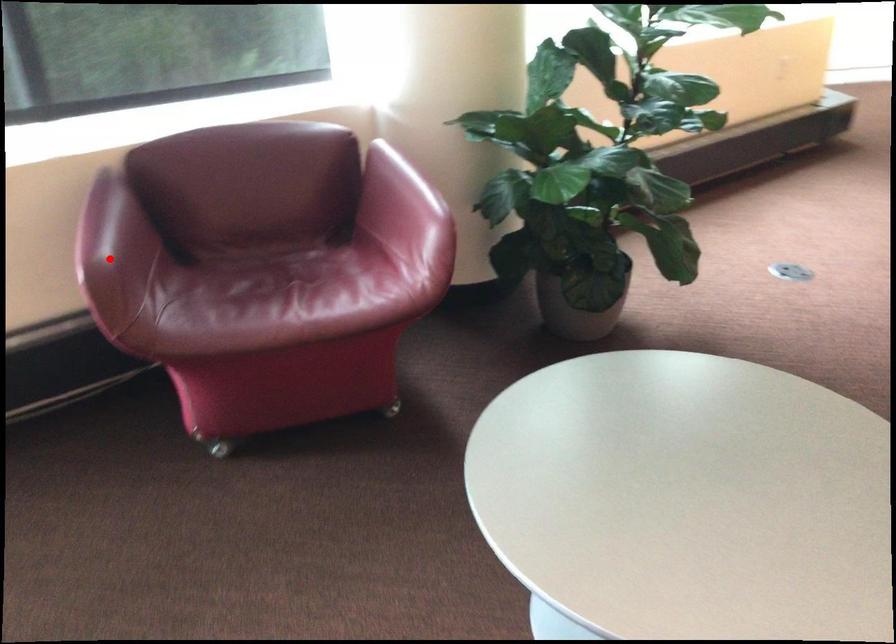
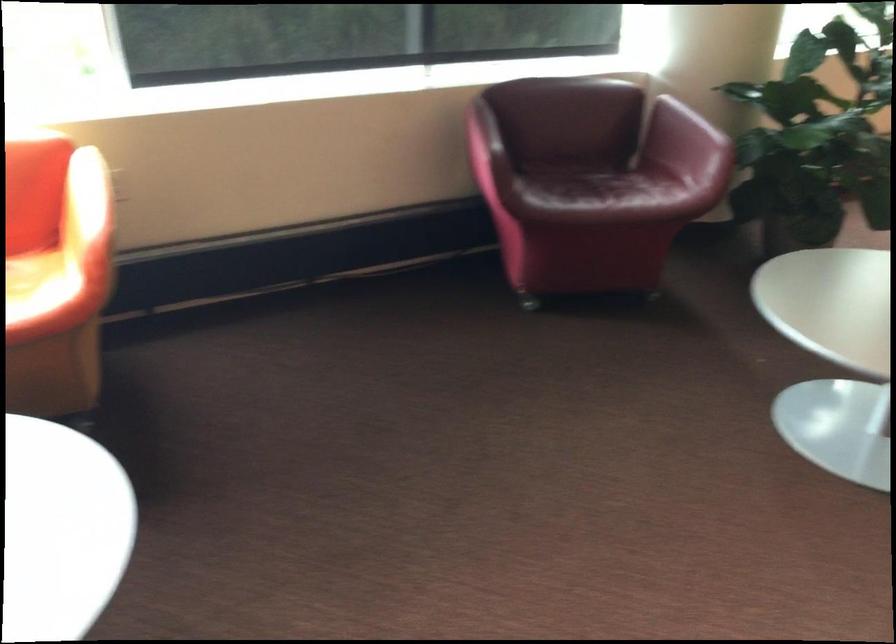
Where in the second image is the point corresponding to the highlighted location from the first image?

(483, 140)